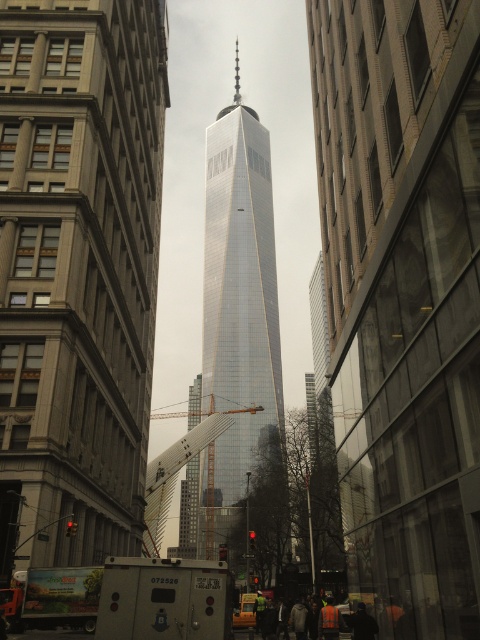
Question: Can you confirm if shiny glass skyscraper at center is wider than metallic silver crane at center?

Choices:
 (A) yes
 (B) no

Answer: (B)

Question: Considering the real-world distances, which object is closest to the metallic silver crane at center?

Choices:
 (A) glassy reflective skyscraper at center
 (B) shiny glass skyscraper at center

Answer: (A)

Question: Considering the relative positions of shiny glass skyscraper at center and metallic silver crane at center in the image provided, where is shiny glass skyscraper at center located with respect to metallic silver crane at center?

Choices:
 (A) above
 (B) below

Answer: (A)

Question: Which point is closer to the camera taking this photo?

Choices:
 (A) (165, 481)
 (B) (6, 564)

Answer: (B)

Question: Which point is farther to the camera?

Choices:
 (A) (214, 141)
 (B) (169, 493)
 (C) (45, 32)

Answer: (A)

Question: Observing the image, what is the correct spatial positioning of glassy reflective skyscraper at center in reference to shiny glass skyscraper at center?

Choices:
 (A) right
 (B) left

Answer: (B)